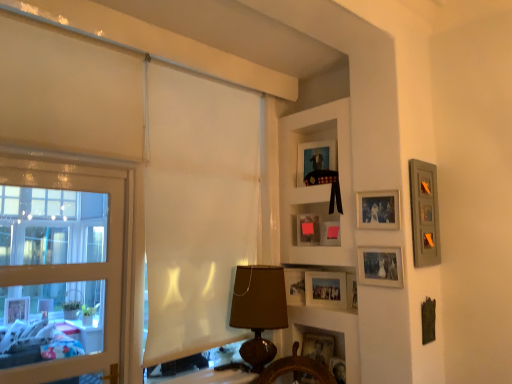
Question: Can you confirm if wooden shelf at upper center, positioned as the first shelf in top-to-bottom order, is bigger than matte pink picture frame at center, placed as the sixth picture frame when sorted from bottom to top?

Choices:
 (A) no
 (B) yes

Answer: (B)

Question: From the image's perspective, is wooden shelf at upper center, positioned as the second shelf in bottom-to-top order, on matte pink picture frame at center, the fourth picture frame viewed from the top?

Choices:
 (A) no
 (B) yes

Answer: (B)

Question: From a real-world perspective, does wooden shelf at upper center, positioned as the first shelf in top-to-bottom order, stand above matte pink picture frame at center, placed as the sixth picture frame when sorted from bottom to top?

Choices:
 (A) no
 (B) yes

Answer: (B)

Question: Considering the relative positions of wooden shelf at upper center, positioned as the second shelf in bottom-to-top order, and matte pink picture frame at center, the fourth picture frame viewed from the top, in the image provided, is wooden shelf at upper center, positioned as the second shelf in bottom-to-top order, behind matte pink picture frame at center, the fourth picture frame viewed from the top,?

Choices:
 (A) yes
 (B) no

Answer: (B)

Question: Considering the relative sizes of wooden shelf at upper center, positioned as the first shelf in top-to-bottom order, and matte pink picture frame at center, placed as the sixth picture frame when sorted from bottom to top, in the image provided, is wooden shelf at upper center, positioned as the first shelf in top-to-bottom order, taller than matte pink picture frame at center, placed as the sixth picture frame when sorted from bottom to top,?

Choices:
 (A) yes
 (B) no

Answer: (A)

Question: Is matte pink picture frame at center, the fourth picture frame viewed from the top, at the back of wooden shelf at upper center, positioned as the first shelf in top-to-bottom order?

Choices:
 (A) no
 (B) yes

Answer: (B)

Question: Is matte black picture frame at upper center, arranged as the 1th picture frame when viewed from the top, next to brown fabric lampshade at center?

Choices:
 (A) no
 (B) yes

Answer: (A)

Question: Can you confirm if matte black picture frame at upper center, the ninth picture frame ordered from the bottom, is shorter than brown fabric lampshade at center?

Choices:
 (A) yes
 (B) no

Answer: (A)

Question: From a real-world perspective, does matte black picture frame at upper center, the ninth picture frame ordered from the bottom, stand above brown fabric lampshade at center?

Choices:
 (A) no
 (B) yes

Answer: (B)

Question: Is matte black picture frame at upper center, arranged as the 1th picture frame when viewed from the top, positioned before brown fabric lampshade at center?

Choices:
 (A) no
 (B) yes

Answer: (A)

Question: Is matte black picture frame at upper center, arranged as the 1th picture frame when viewed from the top, not inside brown fabric lampshade at center?

Choices:
 (A) yes
 (B) no

Answer: (A)

Question: Is matte black picture frame at upper center, the ninth picture frame ordered from the bottom, behind brown fabric lampshade at center?

Choices:
 (A) no
 (B) yes

Answer: (B)

Question: Could you tell me if matte pink picture frame at center, acting as the fifth picture frame starting from the bottom, is facing wooden picture frame at lower center, the first picture frame when ordered from bottom to top?

Choices:
 (A) no
 (B) yes

Answer: (A)